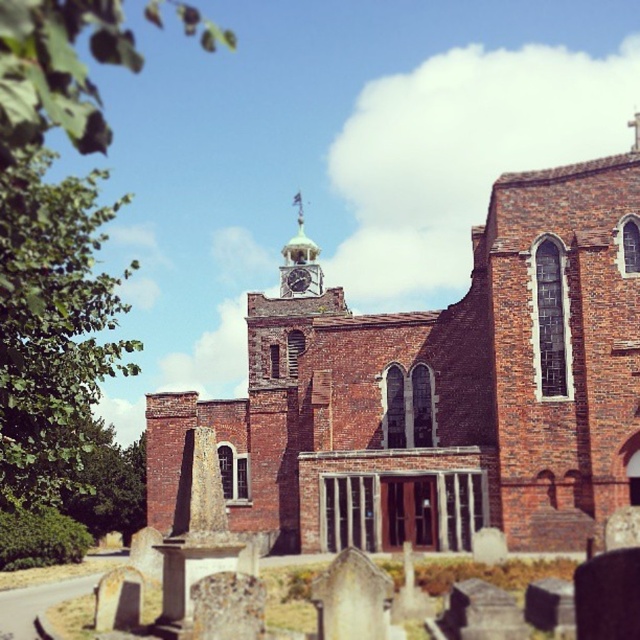
You are standing at the center of the image. Which direction should you face to see the brick church at center?

Since the brick church at center is located at point (444, 390), you should face towards the center of the image to see it.

You are standing at the historic brick church and want to walk towards the point marked as point (x=301, y=269). However, there is an obstacle at point (x=467, y=388). Will you be able to reach your destination without going around the obstacle?

Point (x=467, y=388) is in front of point (x=301, y=269), so the obstacle at point (x=467, y=388) is blocking the path to the destination. You will need to go around the obstacle to reach point (x=301, y=269).